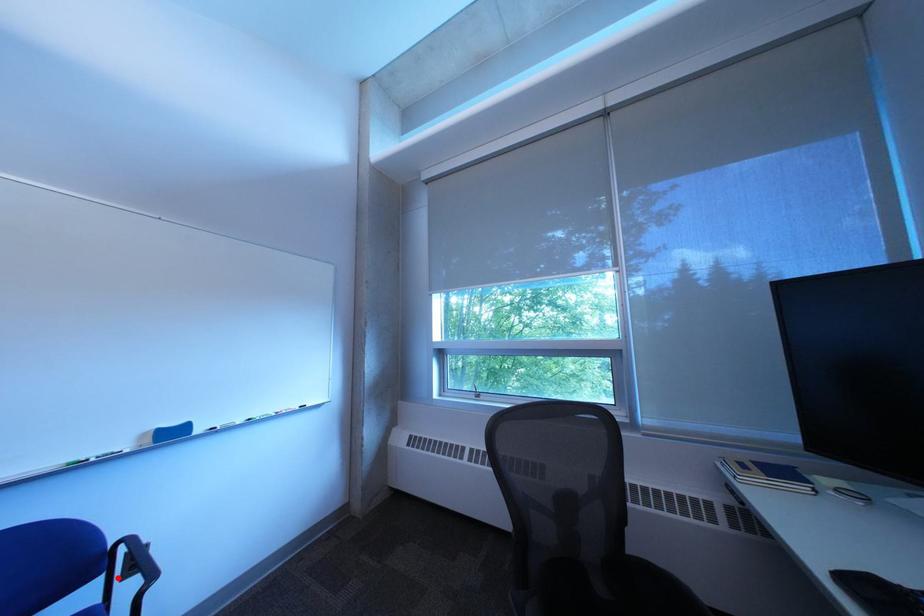
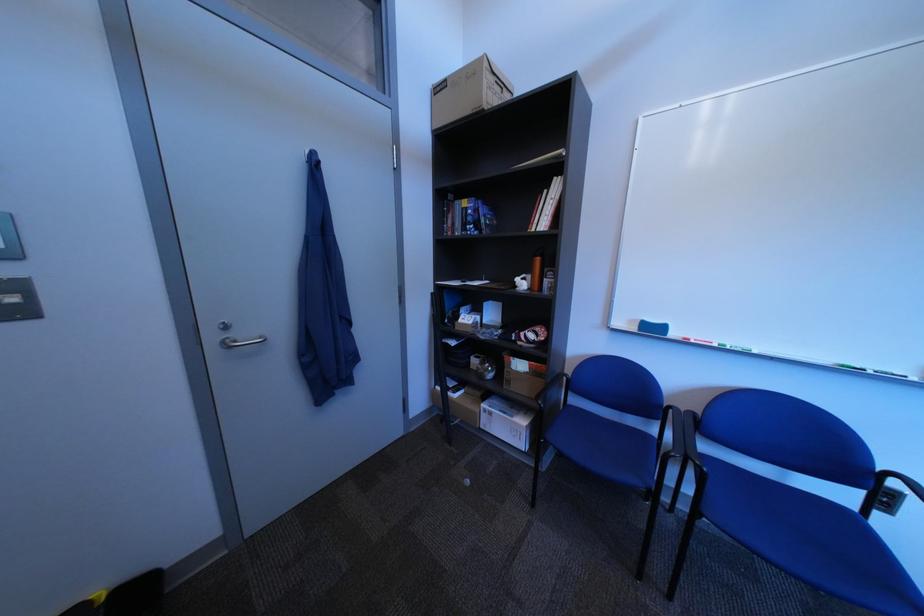
In the second image, find the point that corresponds to the highlighted location in the first image.

(881, 493)